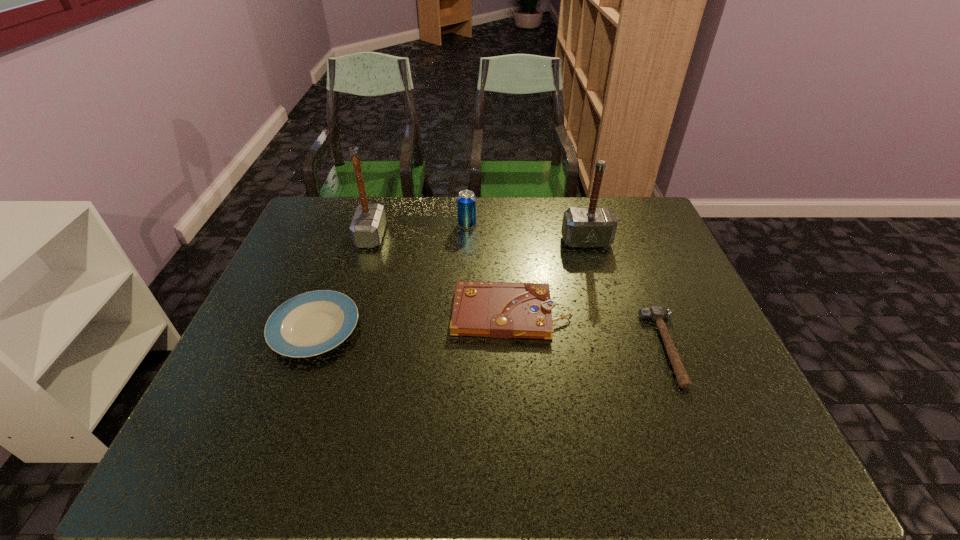
Identify the location of free spot that satisfies the following two spatial constraints: 1. on the back side of the plate; 2. on the right side of the second object from right to left. This screenshot has width=960, height=540. (347, 241).